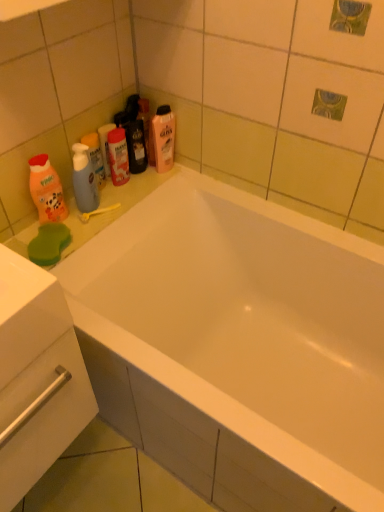
Locate an element on the screen. vacant area that is in front of translucent plastic bottle at upper center, the 2th cleaning product from the front is located at coordinates (140, 187).